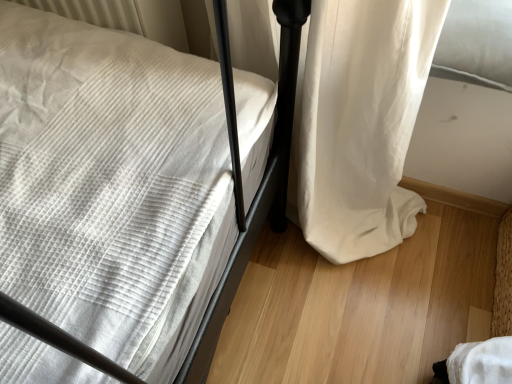
In order to click on white textured bed at center in this screenshot , I will do [x=241, y=180].

Describe the element at coordinates (241, 180) in the screenshot. I see `white textured bed at center` at that location.

Identify the location of white textured bed at center. The width and height of the screenshot is (512, 384). point(241,180).